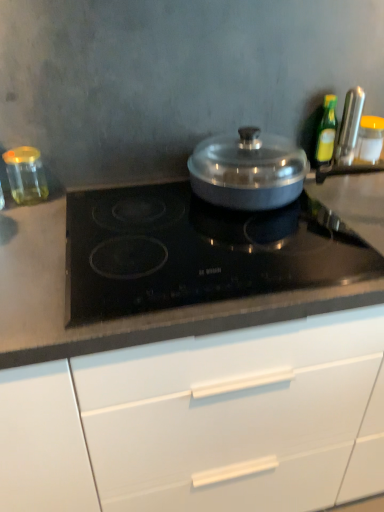
Question: From a real-world perspective, is metallic silver knife at upper right, the 2th kitchen appliance viewed from the right, physically above yellow lid glass jar at right, which ranks as the first kitchen appliance in right-to-left order?

Choices:
 (A) yes
 (B) no

Answer: (A)

Question: Is metallic silver knife at upper right, which is counted as the third kitchen appliance, starting from the left, wider than yellow lid glass jar at right, the 4th kitchen appliance viewed from the left?

Choices:
 (A) yes
 (B) no

Answer: (B)

Question: From a real-world perspective, is metallic silver knife at upper right, the 2th kitchen appliance viewed from the right, beneath yellow lid glass jar at right, which ranks as the first kitchen appliance in right-to-left order?

Choices:
 (A) no
 (B) yes

Answer: (A)

Question: Does metallic silver knife at upper right, the 2th kitchen appliance viewed from the right, have a larger size compared to yellow lid glass jar at right, which ranks as the first kitchen appliance in right-to-left order?

Choices:
 (A) no
 (B) yes

Answer: (A)

Question: Is metallic silver knife at upper right, the 2th kitchen appliance viewed from the right, thinner than yellow lid glass jar at right, the 4th kitchen appliance viewed from the left?

Choices:
 (A) no
 (B) yes

Answer: (B)

Question: Looking at their shapes, would you say transparent glass jar at left, the first kitchen appliance in the left-to-right sequence, is wider or thinner than black glass cooktop at center?

Choices:
 (A) wide
 (B) thin

Answer: (B)

Question: Is point (18, 158) positioned closer to the camera than point (370, 206)?

Choices:
 (A) closer
 (B) farther

Answer: (B)

Question: Considering the positions of transparent glass jar at left, arranged as the fourth kitchen appliance when viewed from the right, and black glass cooktop at center in the image, is transparent glass jar at left, arranged as the fourth kitchen appliance when viewed from the right, bigger or smaller than black glass cooktop at center?

Choices:
 (A) small
 (B) big

Answer: (A)

Question: In terms of height, does transparent glass jar at left, the first kitchen appliance in the left-to-right sequence, look taller or shorter compared to black glass cooktop at center?

Choices:
 (A) tall
 (B) short

Answer: (A)

Question: Considering their positions, is yellow lid glass jar at right, the 4th kitchen appliance viewed from the left, located in front of or behind metallic silver knife at upper right, which is counted as the third kitchen appliance, starting from the left?

Choices:
 (A) behind
 (B) front

Answer: (A)

Question: Is yellow lid glass jar at right, which ranks as the first kitchen appliance in right-to-left order, taller or shorter than metallic silver knife at upper right, which is counted as the third kitchen appliance, starting from the left?

Choices:
 (A) tall
 (B) short

Answer: (B)

Question: From the image's perspective, is yellow lid glass jar at right, the 4th kitchen appliance viewed from the left, positioned above or below metallic silver knife at upper right, the 2th kitchen appliance viewed from the right?

Choices:
 (A) above
 (B) below

Answer: (B)

Question: Looking at the image, does yellow lid glass jar at right, the 4th kitchen appliance viewed from the left, seem bigger or smaller compared to metallic silver knife at upper right, which is counted as the third kitchen appliance, starting from the left?

Choices:
 (A) small
 (B) big

Answer: (B)

Question: In the image, is transparent glass jar at left, the first kitchen appliance in the left-to-right sequence, on the left side or the right side of yellow lid glass jar at right, which ranks as the first kitchen appliance in right-to-left order?

Choices:
 (A) right
 (B) left

Answer: (B)

Question: From the image's perspective, relative to yellow lid glass jar at right, which ranks as the first kitchen appliance in right-to-left order, is transparent glass jar at left, the first kitchen appliance in the left-to-right sequence, above or below?

Choices:
 (A) below
 (B) above

Answer: (A)